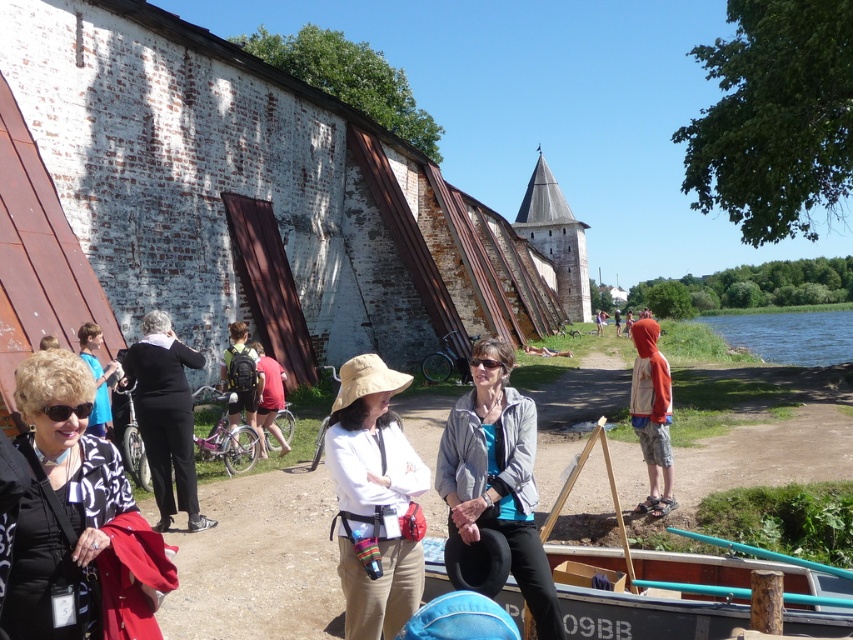
You are a photographer trying to capture a group photo of the black printed cardigan at lower left and the white cotton hat at center. Which object should you focus on first if you want to include both in the frame without moving the camera?

You should focus on the white cotton hat at center first because it occupies more space than the black printed cardigan at lower left, making it easier to ensure both fit in the frame.

You are standing at the center of the image and want to hand a document to the person wearing the black printed cardigan at lower left. In which direction should you move to reach them?

The black printed cardigan at lower left is located at point 0.816 on the x and 0.089 on the y coordinates, so you should move to the lower left direction to reach them.